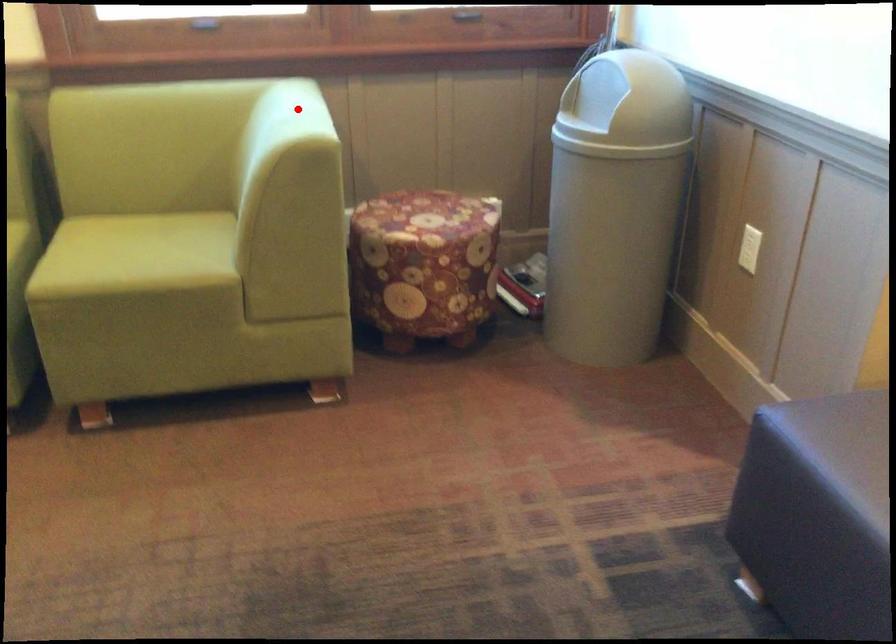
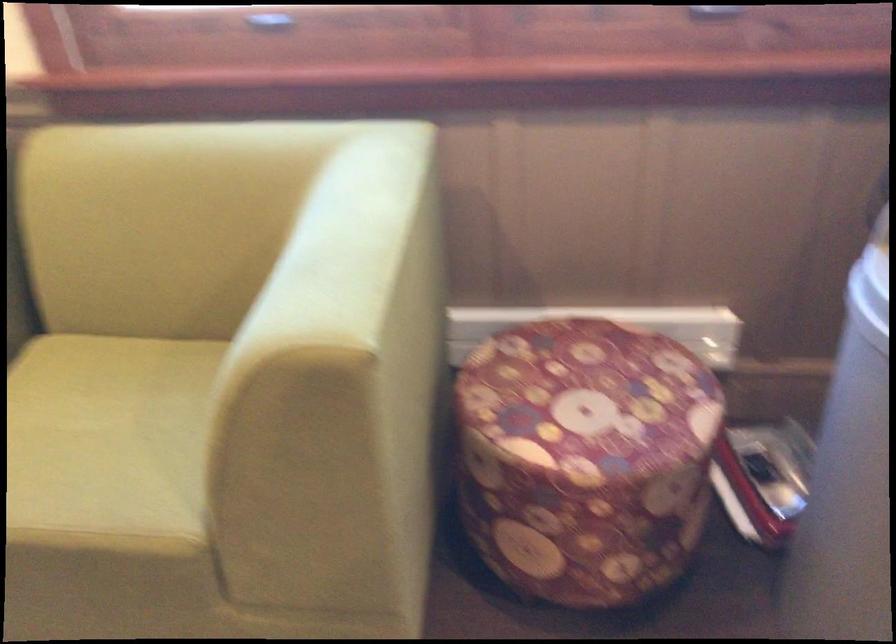
Question: I am providing you with two images of the same scene from different viewpoints. Given a red point in image1, look at the same physical point in image2. Is it:

Choices:
 (A) Closer to the viewpoint
 (B) Farther from the viewpoint

Answer: (A)